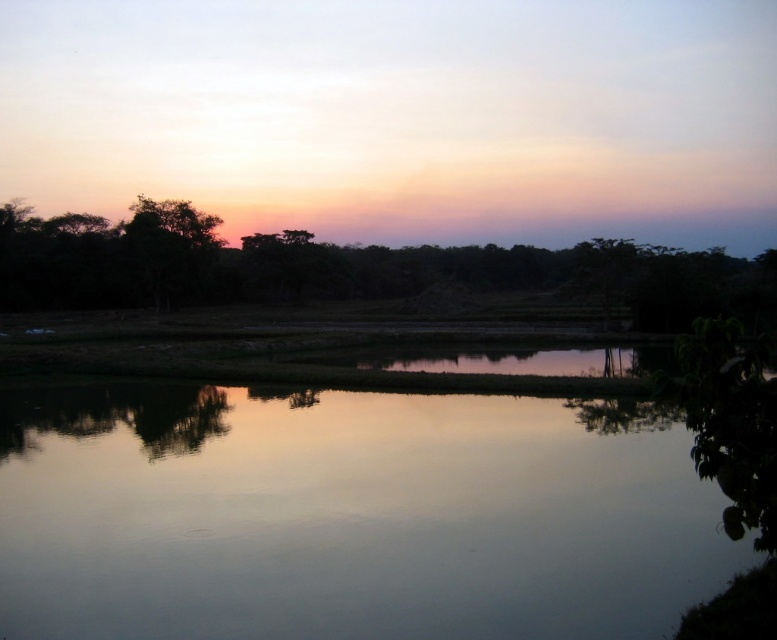
Question: Among these points, which one is nearest to the camera?

Choices:
 (A) coord(469,524)
 (B) coord(77,298)

Answer: (A)

Question: Can you confirm if silvery reflective water at center is positioned to the right of silhouette leafy tree at center?

Choices:
 (A) yes
 (B) no

Answer: (B)

Question: Which point is closer to the camera taking this photo?

Choices:
 (A) (479, 531)
 (B) (347, 285)

Answer: (A)

Question: Where is silvery reflective water at center located in relation to silhouette leafy tree at center in the image?

Choices:
 (A) left
 (B) right

Answer: (A)

Question: Observing the image, what is the correct spatial positioning of silvery reflective water at center in reference to silhouette leafy tree at center?

Choices:
 (A) right
 (B) left

Answer: (B)

Question: Which object appears farthest from the camera in this image?

Choices:
 (A) silhouette leafy tree at center
 (B) silvery reflective water at center

Answer: (A)